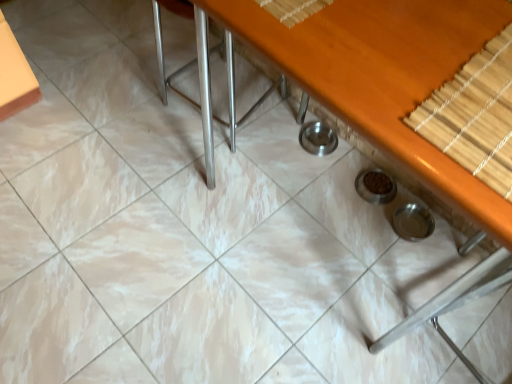
Identify the location of free space between satin silver chair at center and wooden table at center. This screenshot has width=512, height=384. (189, 148).